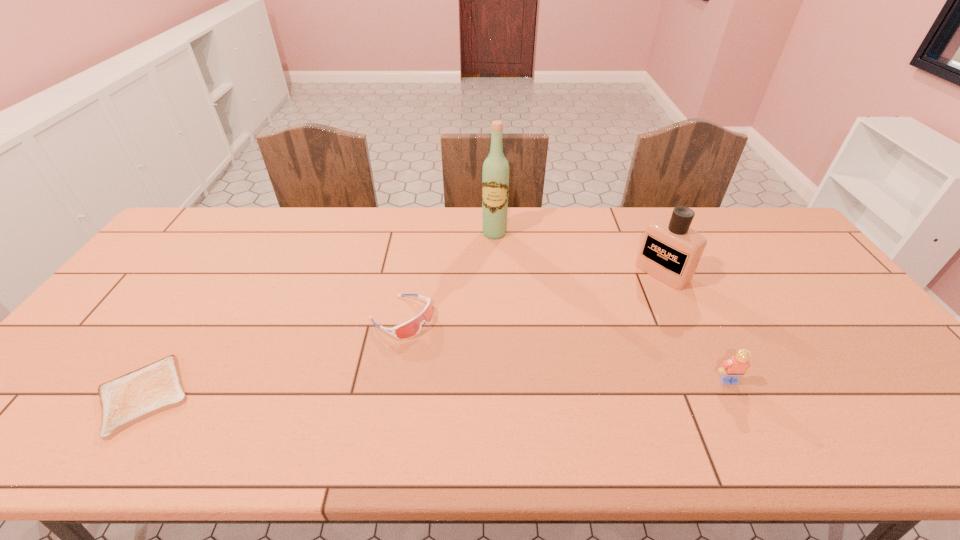
You are a GUI agent. You are given a task and a screenshot of the screen. Output one action in this format:
    pyautogui.click(x=<x>, y=<y>)
    Task: Click on the vacant space located 0.370m on the front label of the perfume
    
    Given the screenshot: What is the action you would take?
    pyautogui.click(x=567, y=348)

Find the location of a particular element. vacant region located 0.370m on the front label of the perfume is located at coordinates (567, 348).

Locate an element on the screen. Image resolution: width=960 pixels, height=540 pixels. vacant space situated on the front label of the perfume is located at coordinates (588, 333).

At what (x,y) coordinates should I click in order to perform the action: click on free location located on the front-facing side of the second object from left to right. Please return your answer as a coordinate pair (x, y). Looking at the image, I should click on (459, 354).

Find the location of a particular element. This screenshot has height=540, width=960. free space located 0.050m on the front-facing side of the second object from left to right is located at coordinates (439, 341).

This screenshot has width=960, height=540. Find the location of `vacant area situated on the front-facing side of the second object from left to right`. vacant area situated on the front-facing side of the second object from left to right is located at coordinates (497, 378).

You are a GUI agent. You are given a task and a screenshot of the screen. Output one action in this format:
    pyautogui.click(x=<x>, y=<y>)
    Task: Click on the free space located 0.400m on the front-facing side of the third object from right to left
    
    Given the screenshot: What is the action you would take?
    471,330

This screenshot has height=540, width=960. What are the coordinates of `vacant space situated on the front-facing side of the third object from right to left` in the screenshot? It's located at (485, 272).

I want to click on free space located 0.060m on the front-facing side of the third object from right to left, so pyautogui.click(x=490, y=252).

Find the location of a particular element. This screenshot has height=540, width=960. object located in the far edge section of the desktop is located at coordinates (495, 175).